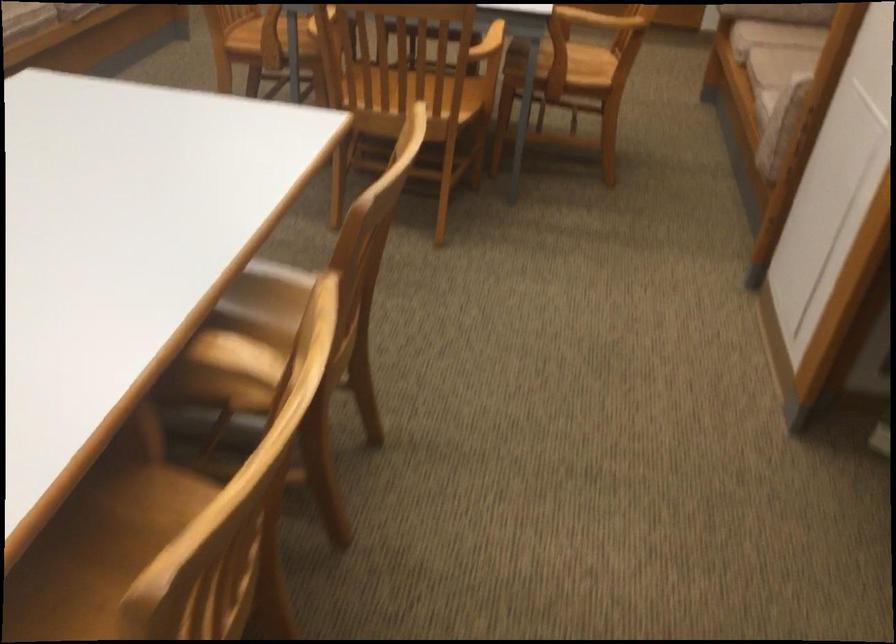
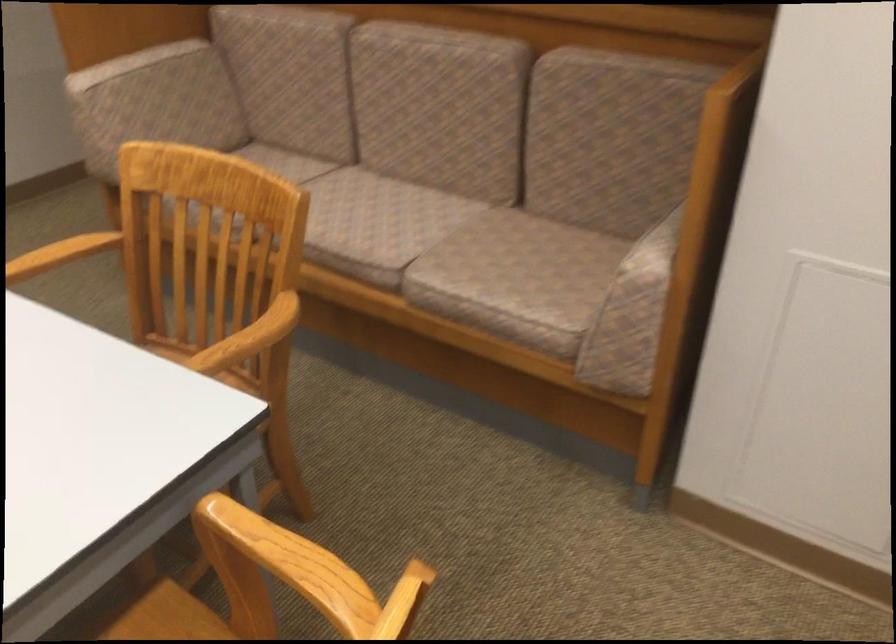
Locate, in the second image, the point that corresponds to (824,75) in the first image.

(655, 248)